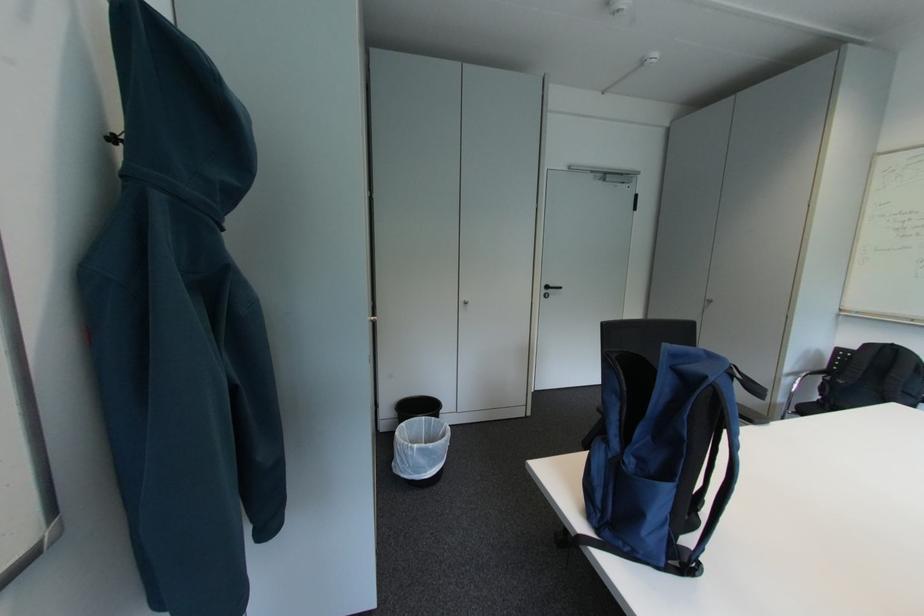
The height and width of the screenshot is (616, 924). I want to click on black door handle, so click(x=550, y=290).